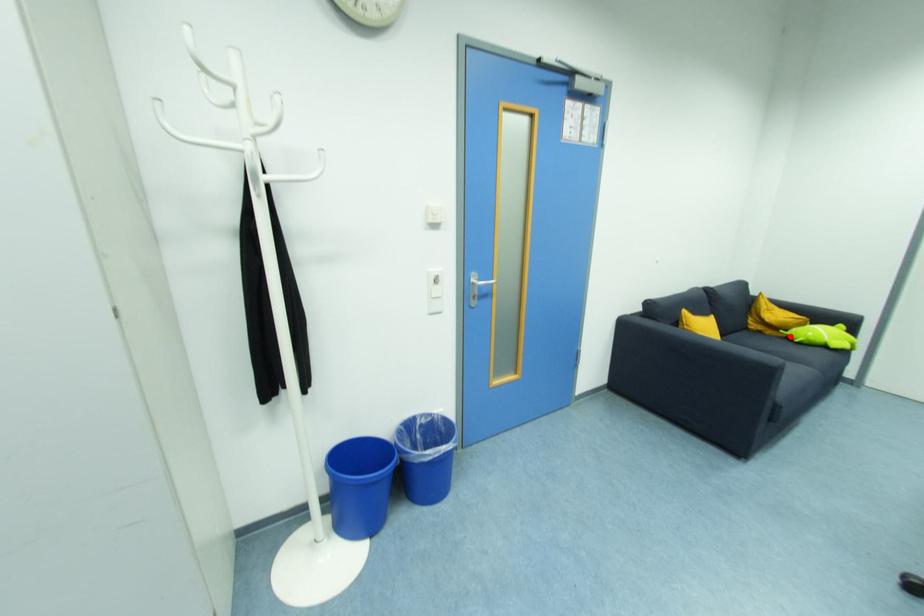
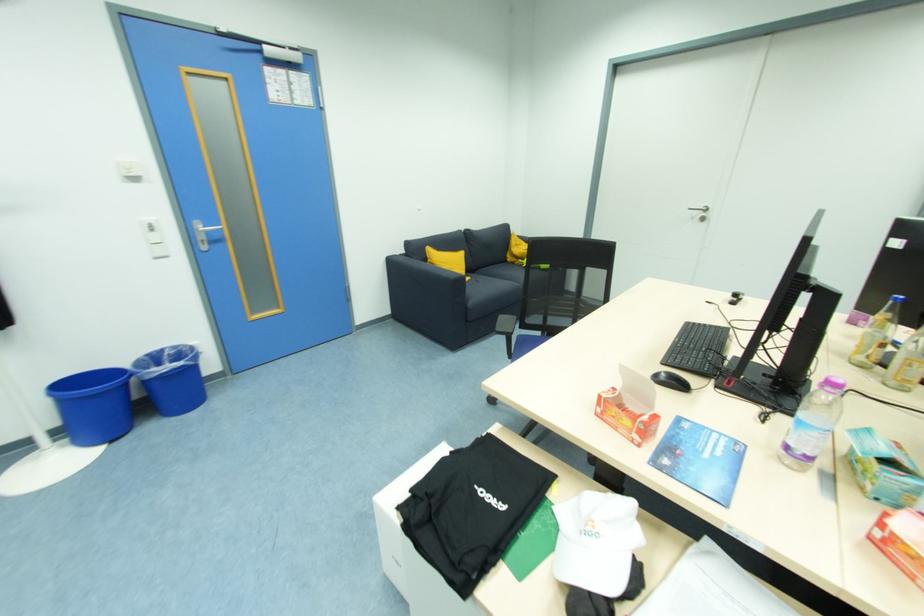
Question: I am providing you with two images of the same scene from different viewpoints. Given a red point in image1, look at the same physical point in image2. Is it:

Choices:
 (A) Closer to the viewpoint
 (B) Farther from the viewpoint

Answer: (A)